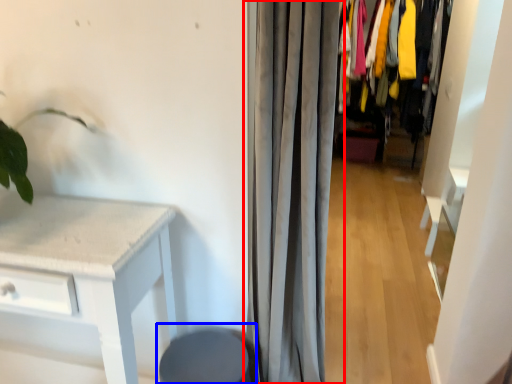
Question: Among these objects, which one is farthest to the camera, curtain (highlighted by a red box) or swivel chair (highlighted by a blue box)?

Choices:
 (A) curtain
 (B) swivel chair

Answer: (B)